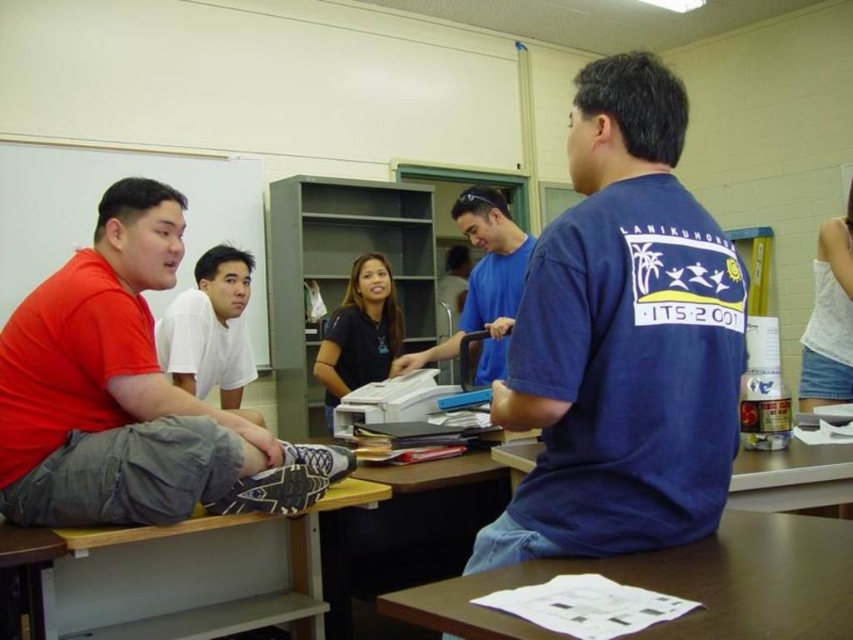
Question: Does brown wooden table at center have a lesser width compared to matte black shirt at center?

Choices:
 (A) no
 (B) yes

Answer: (A)

Question: Among these objects, which one is nearest to the camera?

Choices:
 (A) wooden table at center
 (B) wooden table at lower left
 (C) blue cotton shirt at upper right
 (D) white matte shirt at center

Answer: (A)

Question: Is white matte shirt at center above matte black shirt at center?

Choices:
 (A) no
 (B) yes

Answer: (B)

Question: Among these objects, which one is nearest to the camera?

Choices:
 (A) blue cotton shirt at upper right
 (B) matte black shirt at center

Answer: (A)

Question: Which of these objects is positioned farthest from the blue cotton shirt at upper right?

Choices:
 (A) brown wooden table at center
 (B) matte red shirt at left
 (C) wooden table at center

Answer: (B)

Question: Can you confirm if wooden table at center is positioned to the right of blue cotton shirt at center?

Choices:
 (A) no
 (B) yes

Answer: (B)